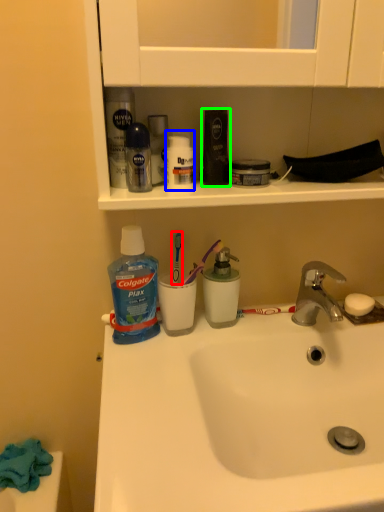
Question: Considering the real-world distances, which object is farthest from toothbrush (highlighted by a red box)? toiletry (highlighted by a blue box) or toiletry (highlighted by a green box)?

Choices:
 (A) toiletry
 (B) toiletry

Answer: (B)